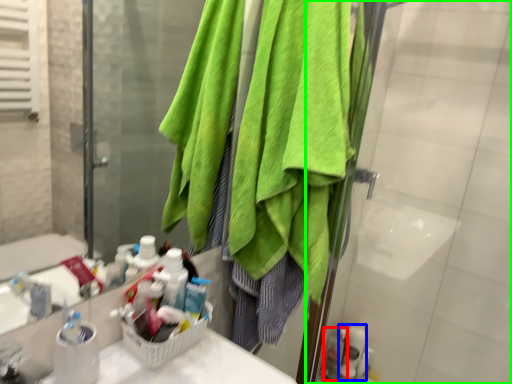
Question: Which is nearer to the toiletry (highlighted by a red box)? toiletry (highlighted by a blue box) or screen door (highlighted by a green box).

Choices:
 (A) toiletry
 (B) screen door

Answer: (A)